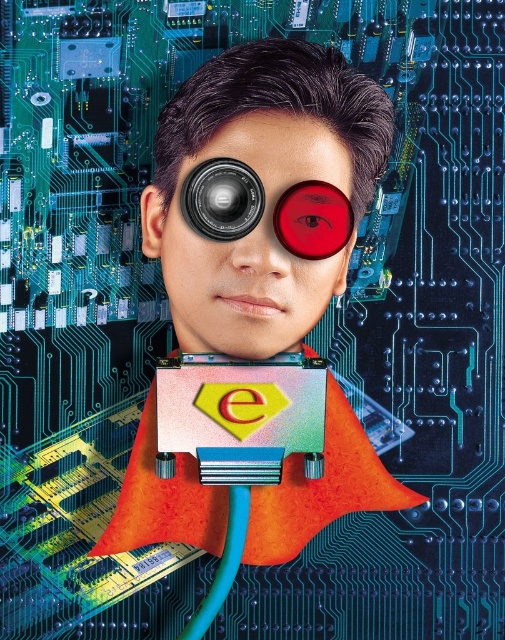
How much distance is there between metallic circuit board at center and black metallic lens at center?

metallic circuit board at center is 6.00 inches from black metallic lens at center.

Which is in front, point (257, 332) or point (211, 177)?

Point (211, 177) is in front.

Describe the element at coordinates (264, 188) in the screenshot. I see `metallic circuit board at center` at that location.

Identify the location of metallic circuit board at center. [264, 188].

Does matte black lens at center appear on the right side of black metallic lens at center?

Indeed, matte black lens at center is positioned on the right side of black metallic lens at center.

In the scene shown: Does matte black lens at center have a lesser width compared to black metallic lens at center?

No, matte black lens at center is not thinner than black metallic lens at center.

You are a GUI agent. You are given a task and a screenshot of the screen. Output one action in this format:
    pyautogui.click(x=<x>, y=<y>)
    Task: Click on the matte black lens at center
    The image size is (505, 640).
    Given the screenshot: What is the action you would take?
    pyautogui.click(x=222, y=198)

Find the location of a particular element. The image size is (505, 640). matte black lens at center is located at coordinates (222, 198).

Describe the element at coordinates (264, 188) in the screenshot. Image resolution: width=505 pixels, height=640 pixels. I see `metallic circuit board at center` at that location.

Who is more distant from viewer, (372, 449) or (317, 243)?

The point (372, 449) is more distant.

I want to click on metallic circuit board at center, so click(264, 188).